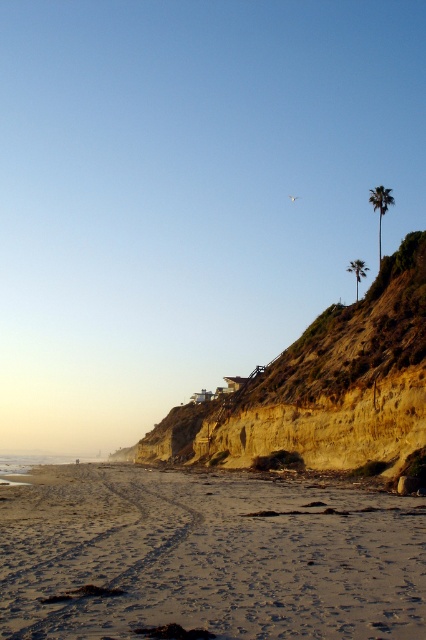
Who is higher up, sandy beach at lower left or brown/dry soil cliff at center-right?

Positioned higher is sandy beach at lower left.

Between sandy beach at lower left and brown/dry soil cliff at center-right, which one has more height?

brown/dry soil cliff at center-right

Does point (189, 492) come in front of point (152, 458)?

Yes.

Where is `sandy beach at lower left`? sandy beach at lower left is located at coordinates (207, 554).

Who is lower down, sandy beach at lower left or green leafy palm tree at upper right?

sandy beach at lower left is below.

Can you confirm if sandy beach at lower left is positioned to the right of green leafy palm tree at upper right?

No, sandy beach at lower left is not to the right of green leafy palm tree at upper right.

At what (x,y) coordinates should I click in order to perform the action: click on sandy beach at lower left. Please return your answer as a coordinate pair (x, y). Looking at the image, I should click on (207, 554).

I want to click on sandy beach at lower left, so coord(207,554).

Who is lower down, brown/dry soil cliff at center-right or green leafy palm tree at upper right?

Positioned lower is brown/dry soil cliff at center-right.

Is brown/dry soil cliff at center-right smaller than green leafy palm tree at upper right?

Indeed, brown/dry soil cliff at center-right has a smaller size compared to green leafy palm tree at upper right.

Find the location of `brown/dry soil cliff at center-right`. brown/dry soil cliff at center-right is located at coordinates (325, 385).

Locate an element on the screen. brown/dry soil cliff at center-right is located at coordinates (325, 385).